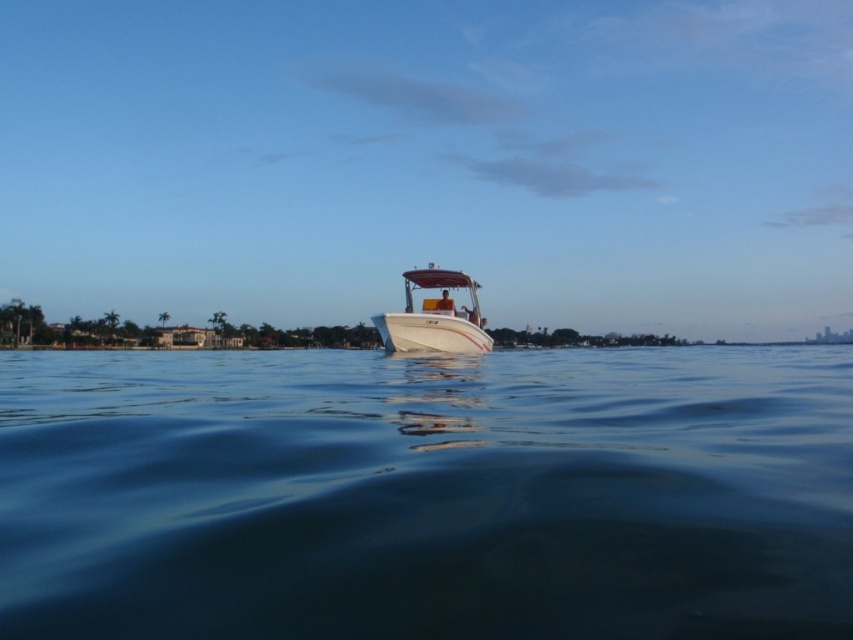
Is clear blue water at center shorter than white glossy boat at center?

Yes, clear blue water at center is shorter than white glossy boat at center.

Between clear blue water at center and white glossy boat at center, which one is positioned higher?

white glossy boat at center is above.

Who is more forward, [151,440] or [463,324]?

Point [151,440]

At what (x,y) coordinates should I click in order to perform the action: click on clear blue water at center. Please return your answer as a coordinate pair (x, y). This screenshot has height=640, width=853. Looking at the image, I should click on (426, 493).